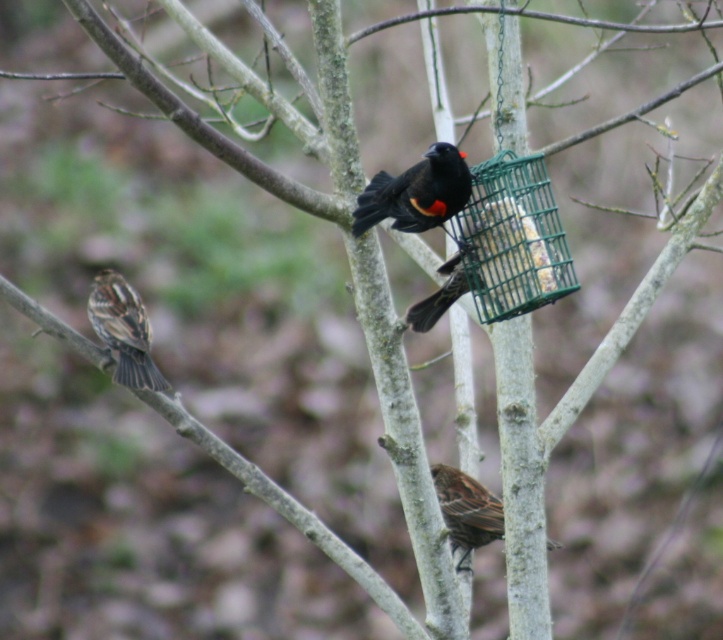
You are a birdwatcher observing the scene. You notice the brown speckled sparrow at lower center and the shiny black bird at center. Which bird is positioned lower in the image?

The brown speckled sparrow at lower center is positioned lower than the shiny black bird at center.

You are standing in front of the tree and want to know which of the two points, point (419,230) or point (124,289), is closer to you. Based on the scene description, can you determine which point is nearer?

Point (419,230) is closer to the viewer than point (124,289).